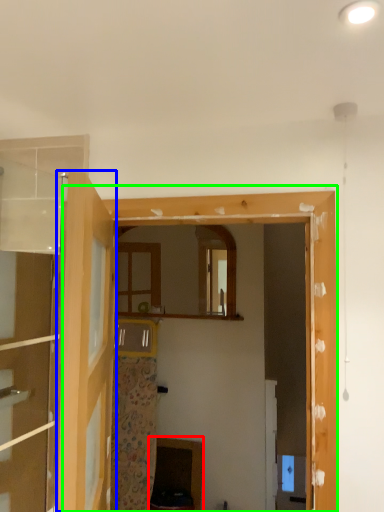
Question: Which is farther away from cabinetry (highlighted by a red box)? door (highlighted by a blue box) or window frame (highlighted by a green box)?

Choices:
 (A) door
 (B) window frame

Answer: (A)